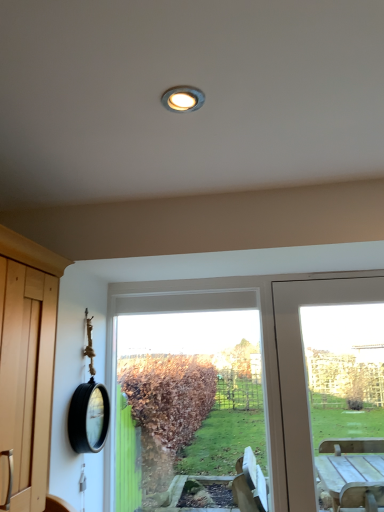
The height and width of the screenshot is (512, 384). What do you see at coordinates (202, 310) in the screenshot? I see `clear glass window at center` at bounding box center [202, 310].

Locate an element on the screen. This screenshot has width=384, height=512. clear glass window at center is located at coordinates (202, 310).

You are a GUI agent. You are given a task and a screenshot of the screen. Output one action in this format:
    pyautogui.click(x=<x>, y=<y>)
    Task: Click on the clear glass window at center
    
    Given the screenshot: What is the action you would take?
    pyautogui.click(x=202, y=310)